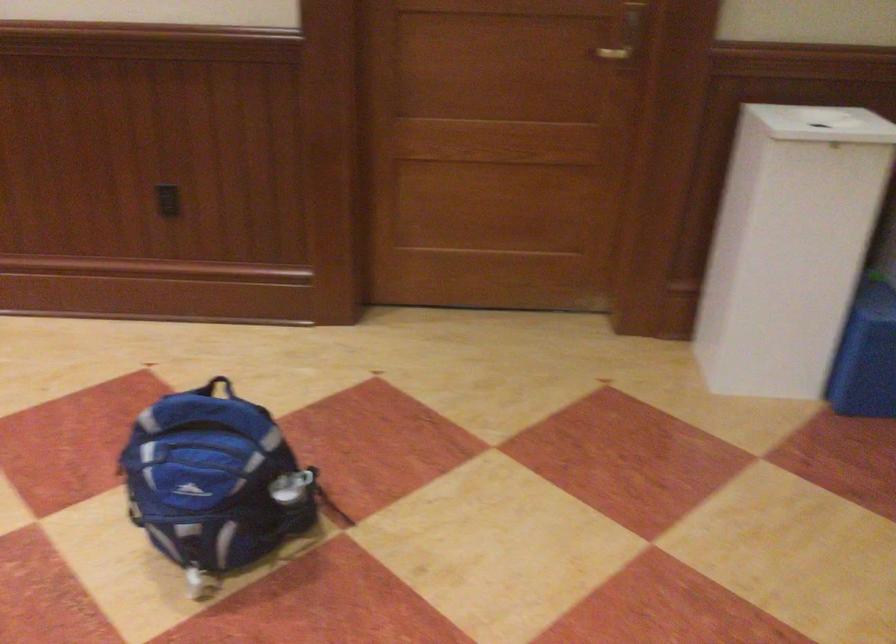
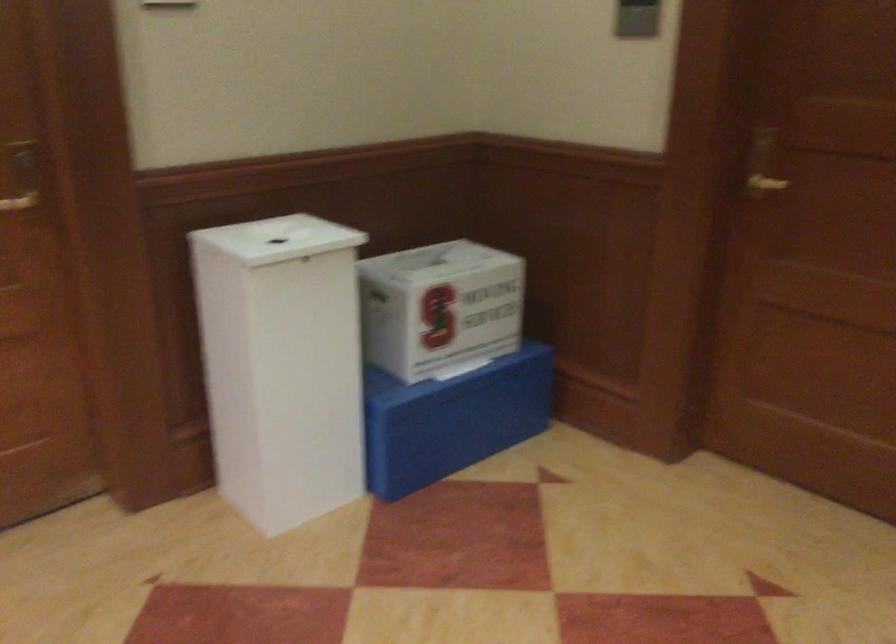
Locate, in the second image, the point that corresponds to [821,120] in the first image.

(277, 238)